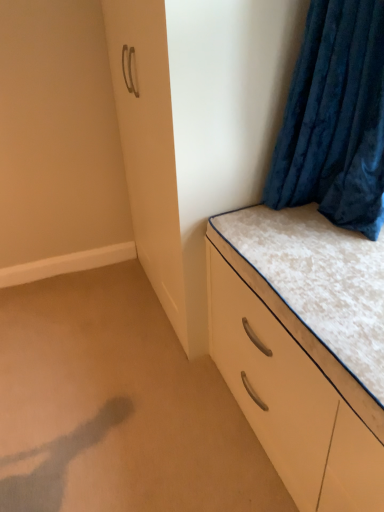
Question: Is beige carpet at lower left smaller than velvet blue curtain at upper right?

Choices:
 (A) yes
 (B) no

Answer: (B)

Question: Considering the relative positions of beige carpet at lower left and velvet blue curtain at upper right in the image provided, is beige carpet at lower left to the right of velvet blue curtain at upper right from the viewer's perspective?

Choices:
 (A) yes
 (B) no

Answer: (B)

Question: Could velvet blue curtain at upper right be considered to be inside beige carpet at lower left?

Choices:
 (A) no
 (B) yes

Answer: (A)

Question: Is beige carpet at lower left to the left of velvet blue curtain at upper right from the viewer's perspective?

Choices:
 (A) no
 (B) yes

Answer: (B)

Question: Is beige carpet at lower left completely or partially outside of velvet blue curtain at upper right?

Choices:
 (A) no
 (B) yes

Answer: (B)

Question: From the image's perspective, would you say beige carpet at lower left is positioned over velvet blue curtain at upper right?

Choices:
 (A) yes
 (B) no

Answer: (B)

Question: Is beige carpet at lower left thinner than white glossy chest of drawers at lower right?

Choices:
 (A) yes
 (B) no

Answer: (B)

Question: From a real-world perspective, is beige carpet at lower left located higher than white glossy chest of drawers at lower right?

Choices:
 (A) yes
 (B) no

Answer: (B)

Question: Is white glossy chest of drawers at lower right surrounded by beige carpet at lower left?

Choices:
 (A) yes
 (B) no

Answer: (B)

Question: Can you confirm if beige carpet at lower left is wider than white glossy chest of drawers at lower right?

Choices:
 (A) no
 (B) yes

Answer: (B)

Question: From the image's perspective, is beige carpet at lower left beneath white glossy chest of drawers at lower right?

Choices:
 (A) no
 (B) yes

Answer: (B)

Question: Is beige carpet at lower left smaller than white glossy chest of drawers at lower right?

Choices:
 (A) yes
 (B) no

Answer: (A)

Question: From a real-world perspective, does white glossy chest of drawers at lower right sit lower than velvet blue curtain at upper right?

Choices:
 (A) yes
 (B) no

Answer: (A)